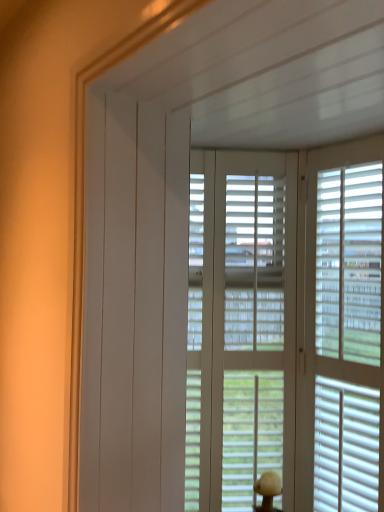
Question: Is white matte window blind at center to the right of white matte blinds at right from the viewer's perspective?

Choices:
 (A) yes
 (B) no

Answer: (B)

Question: From a real-world perspective, is white matte window blind at center on top of white matte blinds at right?

Choices:
 (A) yes
 (B) no

Answer: (B)

Question: Considering the relative sizes of white matte window blind at center and white matte blinds at right in the image provided, is white matte window blind at center taller than white matte blinds at right?

Choices:
 (A) yes
 (B) no

Answer: (A)

Question: Could you tell me if white matte window blind at center is facing white matte blinds at right?

Choices:
 (A) no
 (B) yes

Answer: (A)

Question: Is white matte window blind at center outside white matte blinds at right?

Choices:
 (A) yes
 (B) no

Answer: (A)

Question: Are white matte window blind at center and white matte blinds at right beside each other?

Choices:
 (A) yes
 (B) no

Answer: (A)

Question: Does white matte blinds at right have a greater width compared to white matte window blind at center?

Choices:
 (A) no
 (B) yes

Answer: (A)

Question: Does white matte blinds at right have a larger size compared to white matte window blind at center?

Choices:
 (A) no
 (B) yes

Answer: (A)

Question: Is white matte blinds at right taller than white matte window blind at center?

Choices:
 (A) yes
 (B) no

Answer: (B)

Question: Is white matte blinds at right placed right next to white matte window blind at center?

Choices:
 (A) yes
 (B) no

Answer: (A)

Question: Can you confirm if white matte blinds at right is shorter than white matte window blind at center?

Choices:
 (A) yes
 (B) no

Answer: (A)

Question: Can you confirm if white matte blinds at right is thinner than white matte window blind at center?

Choices:
 (A) yes
 (B) no

Answer: (A)

Question: In terms of width, does white matte window blind at center look wider or thinner when compared to white matte blinds at right?

Choices:
 (A) wide
 (B) thin

Answer: (A)